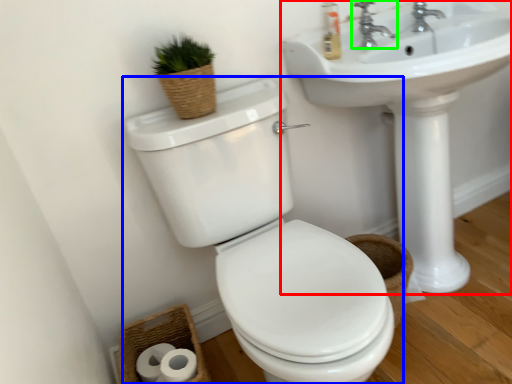
Question: Which object is the closest to the sink (highlighted by a red box)? Choose among these: toilet (highlighted by a blue box) or tap (highlighted by a green box).

Choices:
 (A) toilet
 (B) tap

Answer: (B)